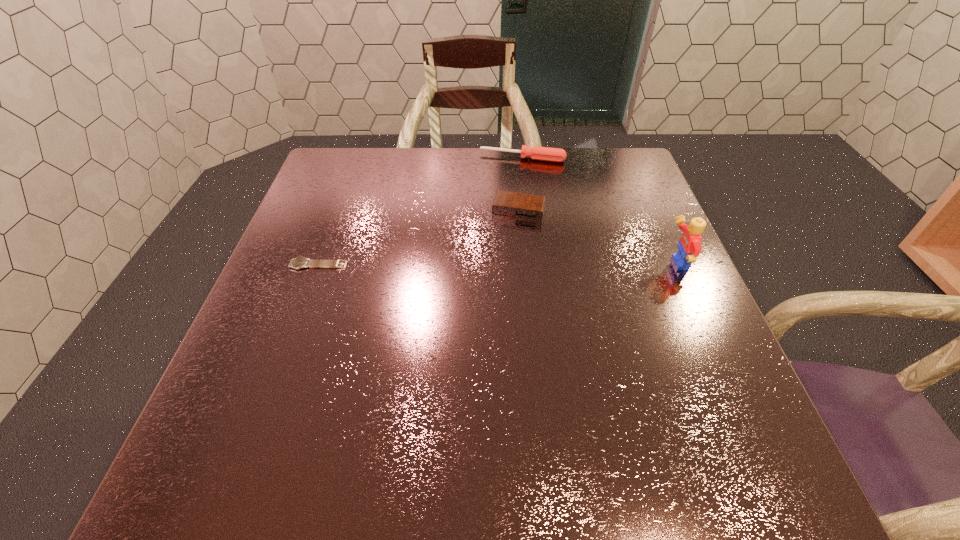
Where is `free region located 0.150m at the blade of the farthest object`? free region located 0.150m at the blade of the farthest object is located at coordinates (508, 194).

Find the location of a particular element. vacant region located at the blade of the farthest object is located at coordinates (497, 232).

Locate an element on the screen. The height and width of the screenshot is (540, 960). free space located 0.100m at the blade of the farthest object is located at coordinates (510, 184).

I want to click on free space located on the front face of the alarm clock, so click(x=477, y=353).

This screenshot has height=540, width=960. I want to click on free spot located 0.200m on the front face of the alarm clock, so click(498, 278).

Locate an element on the screen. Image resolution: width=960 pixels, height=540 pixels. vacant space located 0.320m on the front face of the alarm clock is located at coordinates (487, 321).

Where is `object located in the far edge section of the desktop`? Image resolution: width=960 pixels, height=540 pixels. object located in the far edge section of the desktop is located at coordinates (535, 153).

You are a GUI agent. You are given a task and a screenshot of the screen. Output one action in this format:
    pyautogui.click(x=<x>, y=<y>)
    Task: Click on the object present at the left edge
    
    Given the screenshot: What is the action you would take?
    [x=300, y=262]

This screenshot has height=540, width=960. Find the location of `object located in the right edge section of the desktop`. object located in the right edge section of the desktop is located at coordinates (689, 247).

In the image, there is a desktop. At what (x,y) coordinates should I click in order to perform the action: click on vacant space at the far edge. Please return your answer as a coordinate pair (x, y). Looking at the image, I should click on (394, 167).